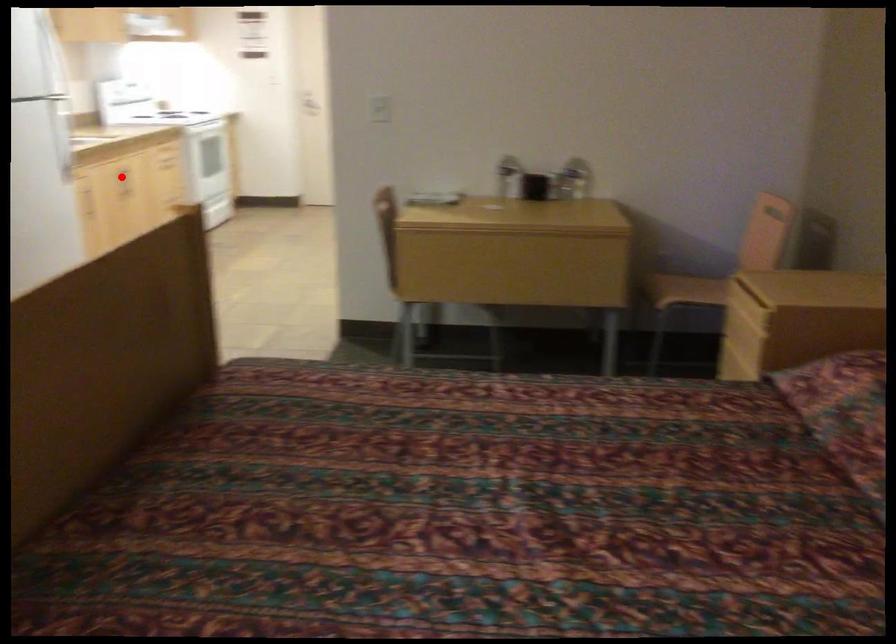
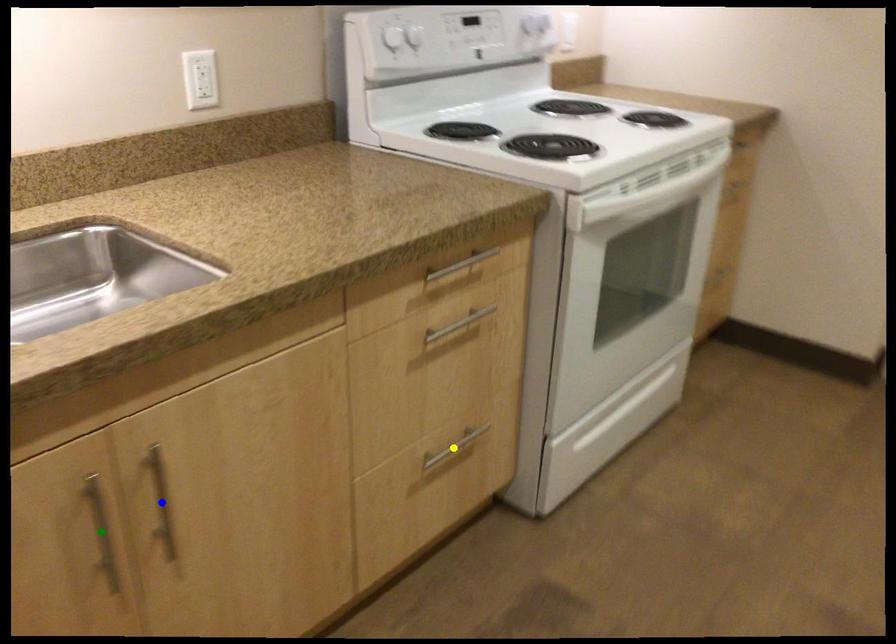
Question: I am providing you with two images of the same scene from different viewpoints. A red point is marked on the first image. You are given multiple points on the second image. Which point in image 2 represents the same 3d spot as the red point in image 1?

Choices:
 (A) green point
 (B) blue point
 (C) yellow point

Answer: (A)